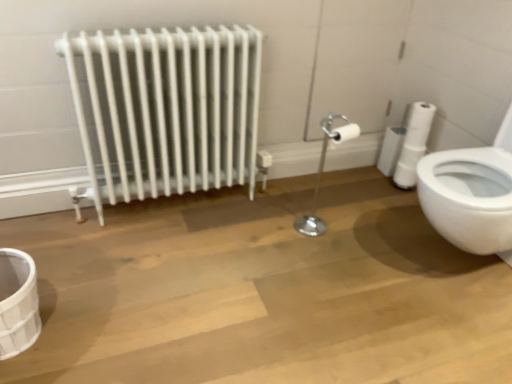
Find the location of a particular element. This screenshot has width=512, height=384. empty space that is to the right of white metallic radiator at left is located at coordinates (294, 224).